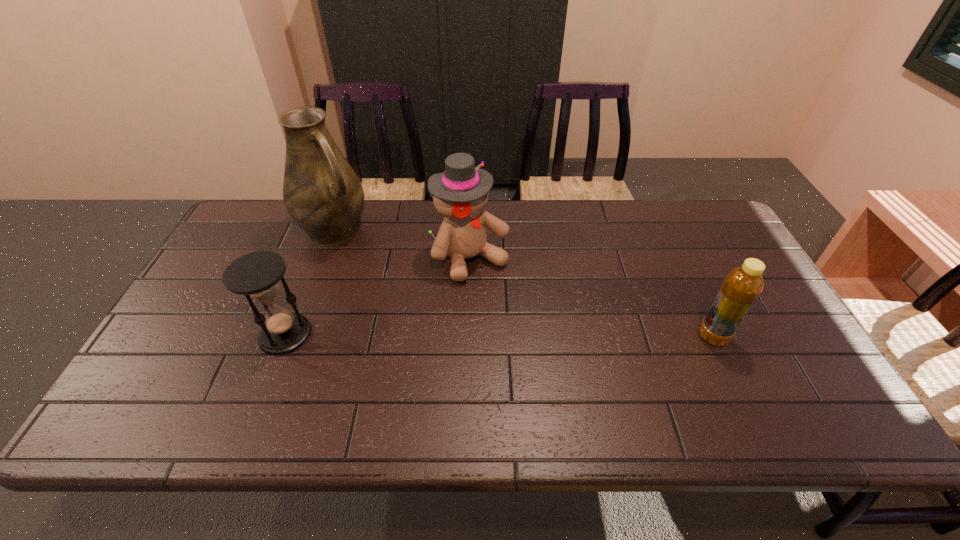
Find the location of a particular element. The width and height of the screenshot is (960, 540). hourglass is located at coordinates (256, 275).

Identify the location of bottle. The width and height of the screenshot is (960, 540). point(742,286).

Locate an element on the screen. The image size is (960, 540). the tallest object is located at coordinates (322, 193).

At what (x,y) coordinates should I click in order to perform the action: click on the third object from left to right. Please return your answer as a coordinate pair (x, y). The width and height of the screenshot is (960, 540). Looking at the image, I should click on (460, 193).

Find the location of a particular element. rag_doll is located at coordinates (460, 193).

I want to click on vacant space positioned on the front of the hourglass, so click(x=269, y=377).

At what (x,y) coordinates should I click in order to perform the action: click on vacant space situated 0.070m on the front of the bottle. Please return your answer as a coordinate pair (x, y). This screenshot has width=960, height=540. Looking at the image, I should click on (730, 373).

Where is `vacant space located on the handle side of the tallest object`? vacant space located on the handle side of the tallest object is located at coordinates (389, 284).

Image resolution: width=960 pixels, height=540 pixels. In order to click on free location located 0.330m on the handle side of the tallest object in this screenshot , I will do `click(414, 307)`.

Locate an element on the screen. The height and width of the screenshot is (540, 960). blank area located 0.070m on the handle side of the tallest object is located at coordinates (364, 258).